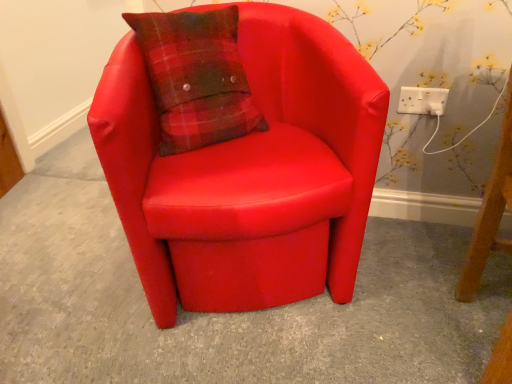
Question: Does white plastic socket at upper right have a lesser height compared to matte red armchair at center?

Choices:
 (A) no
 (B) yes

Answer: (B)

Question: Could you tell me if white plastic socket at upper right is turned towards matte red armchair at center?

Choices:
 (A) no
 (B) yes

Answer: (A)

Question: Considering the relative positions of white plastic socket at upper right and matte red armchair at center in the image provided, is white plastic socket at upper right to the left of matte red armchair at center from the viewer's perspective?

Choices:
 (A) no
 (B) yes

Answer: (A)

Question: Considering the relative sizes of white plastic socket at upper right and matte red armchair at center in the image provided, is white plastic socket at upper right bigger than matte red armchair at center?

Choices:
 (A) no
 (B) yes

Answer: (A)

Question: Is white plastic socket at upper right positioned in front of matte red armchair at center?

Choices:
 (A) yes
 (B) no

Answer: (B)

Question: From the image's perspective, is white plastic socket at upper right on top of matte red armchair at center?

Choices:
 (A) no
 (B) yes

Answer: (B)

Question: Does matte red armchair at center turn towards white plastic socket at upper right?

Choices:
 (A) yes
 (B) no

Answer: (B)

Question: Is matte red armchair at center facing away from white plastic socket at upper right?

Choices:
 (A) yes
 (B) no

Answer: (B)

Question: Is the depth of matte red armchair at center greater than that of white plastic socket at upper right?

Choices:
 (A) yes
 (B) no

Answer: (B)

Question: From the image's perspective, is matte red armchair at center under white plastic socket at upper right?

Choices:
 (A) yes
 (B) no

Answer: (A)

Question: Can you confirm if matte red armchair at center is positioned to the left of white plastic socket at upper right?

Choices:
 (A) no
 (B) yes

Answer: (B)

Question: From the image's perspective, is matte red armchair at center on white plastic socket at upper right?

Choices:
 (A) no
 (B) yes

Answer: (A)

Question: Relative to white plastic socket at upper right, is matte red armchair at center in front or behind?

Choices:
 (A) front
 (B) behind

Answer: (A)